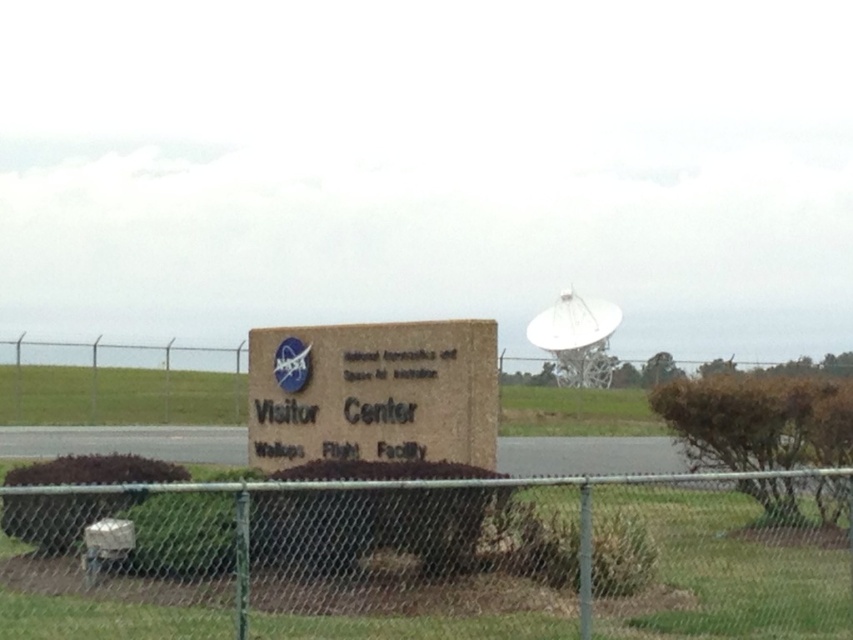
Question: Is the position of green chain-link fence at center more distant than that of brown stone visitor center at center?

Choices:
 (A) yes
 (B) no

Answer: (B)

Question: Which object appears farthest from the camera in this image?

Choices:
 (A) brown stone visitor center at center
 (B) green chain-link fence at center

Answer: (A)

Question: Is green chain-link fence at center thinner than brown stone visitor center at center?

Choices:
 (A) yes
 (B) no

Answer: (A)

Question: Does green chain-link fence at center appear on the right side of brown stone visitor center at center?

Choices:
 (A) yes
 (B) no

Answer: (A)